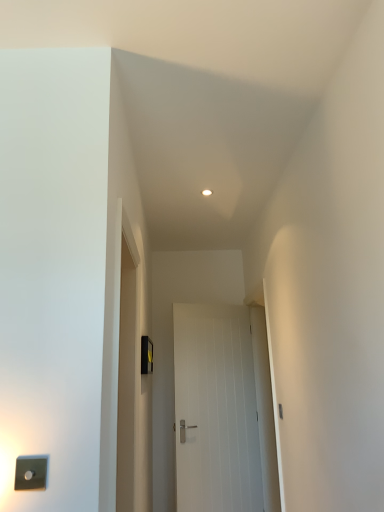
Question: Does satin silver switch at lower left, which appears as the 1th light switch when viewed from the left, have a smaller size compared to white smooth door at center?

Choices:
 (A) yes
 (B) no

Answer: (A)

Question: Is satin silver switch at lower left, arranged as the first light switch when viewed from the front, to the left of white smooth door at center from the viewer's perspective?

Choices:
 (A) yes
 (B) no

Answer: (A)

Question: From a real-world perspective, is satin silver switch at lower left, positioned as the 2th light switch in back-to-front order, over white smooth door at center?

Choices:
 (A) yes
 (B) no

Answer: (A)

Question: Does satin silver switch at lower left, arranged as the first light switch when viewed from the front, have a lesser height compared to white smooth door at center?

Choices:
 (A) no
 (B) yes

Answer: (B)

Question: Does satin silver switch at lower left, which appears as the 1th light switch when viewed from the left, have a greater width compared to white smooth door at center?

Choices:
 (A) yes
 (B) no

Answer: (B)

Question: Is white smooth door at center inside or outside of black plastic light switch at center, the first light switch when ordered from right to left?

Choices:
 (A) inside
 (B) outside

Answer: (B)

Question: From a real-world perspective, relative to black plastic light switch at center, the first light switch when ordered from right to left, is white smooth door at center vertically above or below?

Choices:
 (A) above
 (B) below

Answer: (B)

Question: From the image's perspective, is white smooth door at center located above or below black plastic light switch at center, which is counted as the 2th light switch, starting from the left?

Choices:
 (A) below
 (B) above

Answer: (A)

Question: Does point click(180, 343) appear closer or farther from the camera than point click(142, 372)?

Choices:
 (A) closer
 (B) farther

Answer: (B)

Question: In terms of width, does satin silver switch at lower left, arranged as the 2th light switch when viewed from the right, look wider or thinner when compared to black plastic light switch at center, placed as the 1th light switch when sorted from back to front?

Choices:
 (A) thin
 (B) wide

Answer: (A)

Question: Based on their positions, is satin silver switch at lower left, arranged as the first light switch when viewed from the front, located to the left or right of black plastic light switch at center, the first light switch when ordered from right to left?

Choices:
 (A) left
 (B) right

Answer: (A)

Question: Is point (41, 483) closer or farther from the camera than point (140, 352)?

Choices:
 (A) farther
 (B) closer

Answer: (B)

Question: Relative to black plastic light switch at center, the first light switch when ordered from right to left, is satin silver switch at lower left, which appears as the 1th light switch when viewed from the left, in front or behind?

Choices:
 (A) behind
 (B) front

Answer: (B)

Question: Considering their positions, is black plastic light switch at center, which is counted as the 2th light switch, starting from the left, located in front of or behind satin silver switch at lower left, which appears as the 1th light switch when viewed from the left?

Choices:
 (A) front
 (B) behind

Answer: (B)

Question: Considering the positions of black plastic light switch at center, the 2th light switch when ordered from front to back, and satin silver switch at lower left, which appears as the 1th light switch when viewed from the left, in the image, is black plastic light switch at center, the 2th light switch when ordered from front to back, bigger or smaller than satin silver switch at lower left, which appears as the 1th light switch when viewed from the left,?

Choices:
 (A) big
 (B) small

Answer: (A)